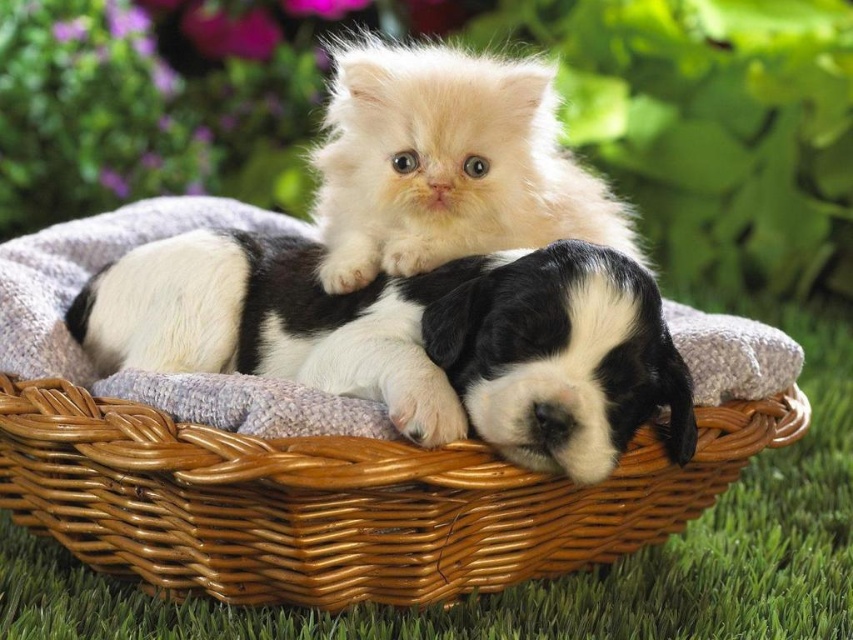
Is point (616, 552) positioned before point (177, 296)?

Yes, it is.

Does woven brown basket at center lie behind black and white fur at center?

No, woven brown basket at center is closer to the viewer.

Where is `woven brown basket at center`? woven brown basket at center is located at coordinates (340, 500).

Does woven brown basket at center come behind fluffy white cat at upper center?

No, it is in front of fluffy white cat at upper center.

Can you confirm if woven brown basket at center is taller than fluffy white cat at upper center?

Incorrect, woven brown basket at center's height is not larger of fluffy white cat at upper center's.

Is point (527, 531) positioned behind point (332, 232)?

No.

Where is `woven brown basket at center`? woven brown basket at center is located at coordinates (340, 500).

Is black and white fur at center smaller than fluffy white cat at upper center?

Actually, black and white fur at center might be larger than fluffy white cat at upper center.

Which is behind, point (426, 348) or point (529, 145)?

The point (529, 145) is more distant.

Does point (396, 384) come closer to viewer compared to point (364, 112)?

Yes.

At what (x,y) coordinates should I click in order to perform the action: click on black and white fur at center. Please return your answer as a coordinate pair (x, y). The width and height of the screenshot is (853, 640). Looking at the image, I should click on (413, 339).